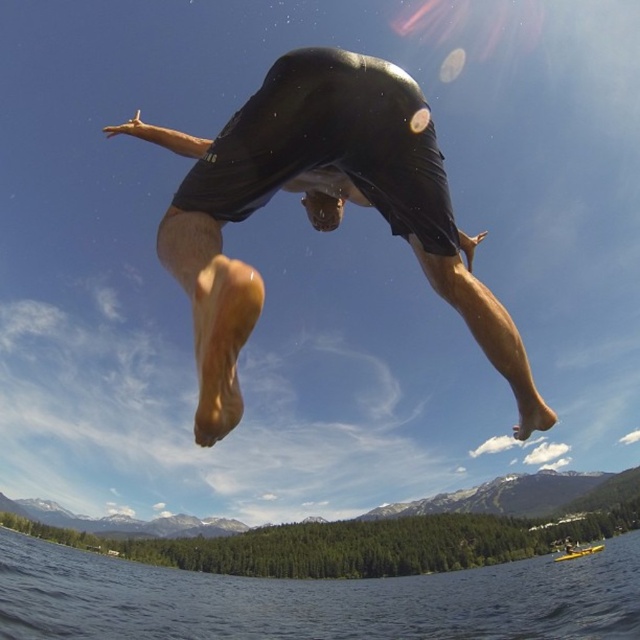
Between black matte shorts at center and black matte wetsuit at center, which one is positioned higher?

Positioned higher is black matte wetsuit at center.

Between point (328, 125) and point (248, 168), which one is positioned in front?

Point (248, 168) is more forward.

Locate an element on the screen. black matte shorts at center is located at coordinates (310, 212).

Does transparent blue water at lower center have a greater width compared to black matte wetsuit at center?

Correct, the width of transparent blue water at lower center exceeds that of black matte wetsuit at center.

Is transparent blue water at lower center in front of black matte wetsuit at center?

No, it is behind black matte wetsuit at center.

This screenshot has width=640, height=640. In order to click on transparent blue water at lower center in this screenshot , I will do `click(314, 600)`.

Based on the photo, between black matte shorts at center and transparent blue water at lower center, which one is positioned lower?

transparent blue water at lower center is below.

Can you confirm if black matte shorts at center is smaller than transparent blue water at lower center?

Indeed, black matte shorts at center has a smaller size compared to transparent blue water at lower center.

Is point (333, 145) positioned behind point (173, 570)?

No, (333, 145) is closer to viewer.

Identify the location of black matte shorts at center. (310, 212).